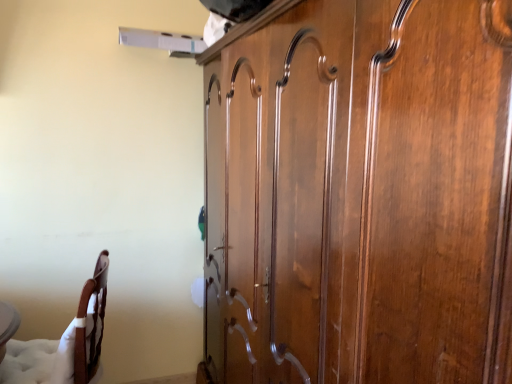
What is the approximate height of white padded chair at lower left?

It is 66.40 centimeters.

Measure the distance between white padded chair at lower left and camera.

white padded chair at lower left and camera are 1.55 meters apart.

Find the location of a particular element. This screenshot has width=512, height=384. white padded chair at lower left is located at coordinates (65, 342).

Measure the distance between point (103, 256) and camera.

Point (103, 256) and camera are 2.01 meters apart from each other.

In order to face white padded chair at lower left, should I rotate leftwards or rightwards?

You should look left and rotate roughly 25.727 degrees.

Describe the element at coordinates (65, 342) in the screenshot. I see `white padded chair at lower left` at that location.

The image size is (512, 384). Identify the location of white padded chair at lower left. (65, 342).